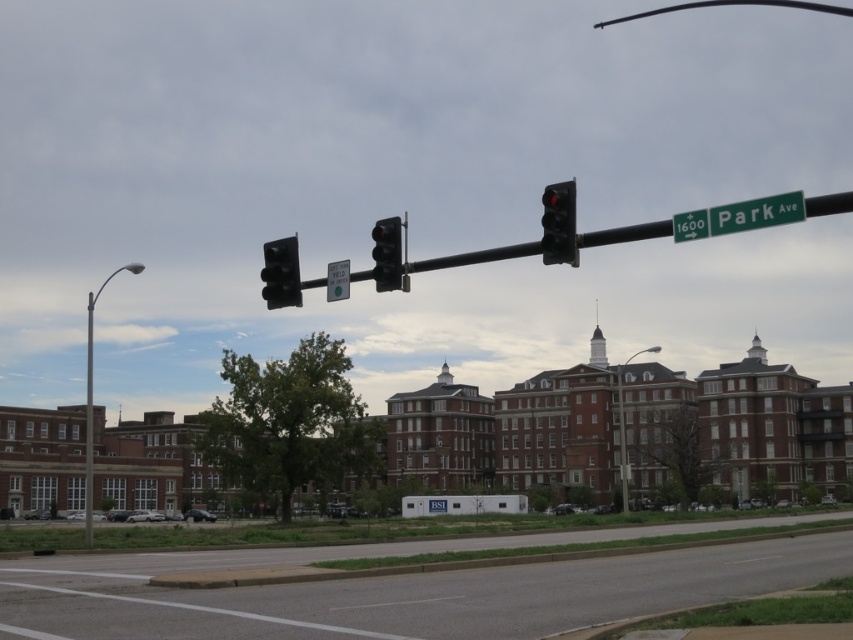
You are a city planner analyzing the street layout. You need to determine if the green metallic street sign at upper right can be replaced with a wider version without obstructing the view of the metallic gray pole at left. Based on their widths, what should you consider?

The green metallic street sign at upper right has a lesser width compared to metallic gray pole at left. Since the current sign is narrower than the pole, replacing it with a wider one might cause obstruction if the new width exceeds the pole.

You are standing at the traffic light and want to take a photo of both point (553,218) and point (619,432) in the scene. Which point will appear larger in your photo?

Point (553,218) will appear larger in the photo because it is closer to the camera than point (619,432).

You are a delivery driver who needs to turn onto Park Ave. You see the green metallic street sign at upper right and the matte black traffic light at upper right. Which one is positioned lower in the scene?

The green metallic street sign at upper right is located below the matte black traffic light at upper right, so it is positioned lower in the scene.